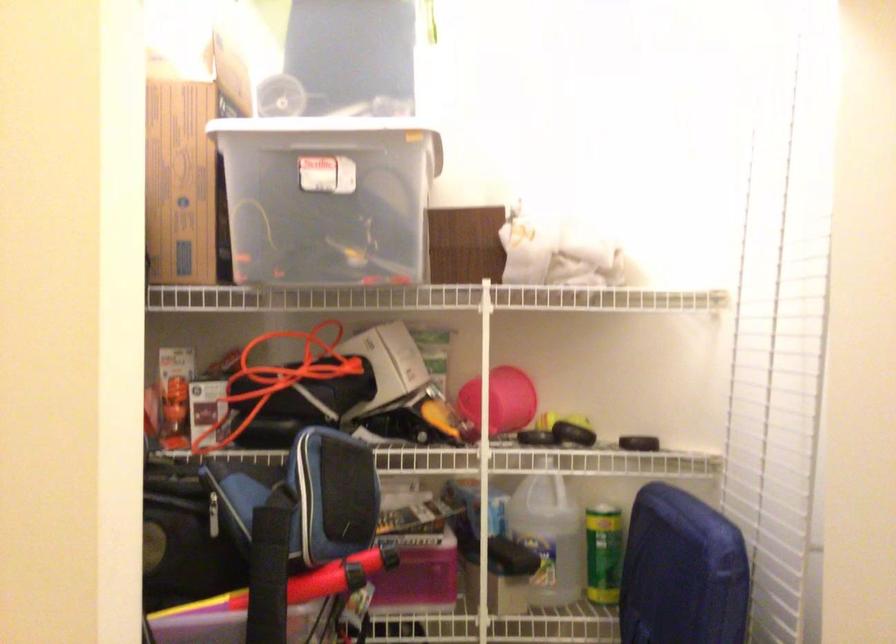
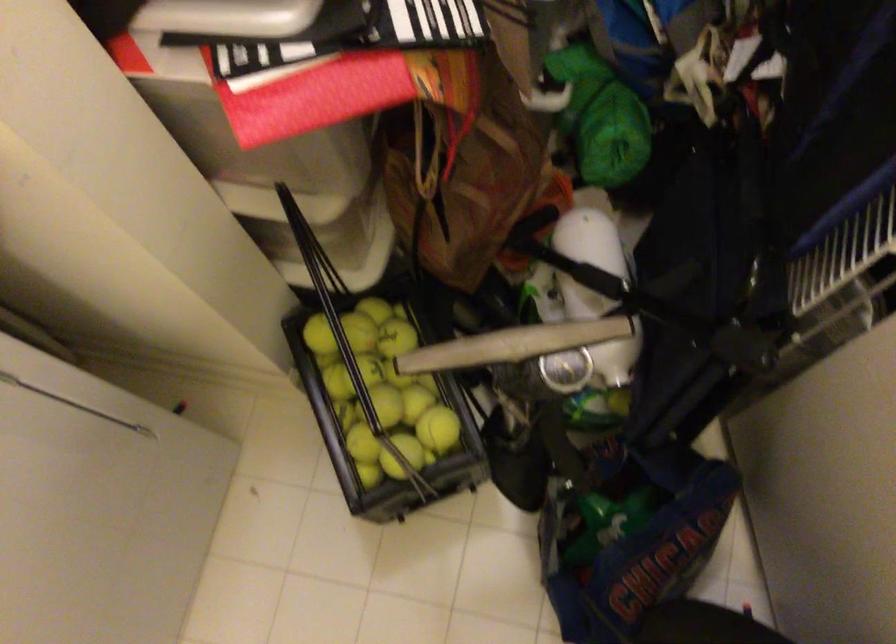
First-person continuous shooting, in which direction is the camera rotating?

The camera's rotation is toward left-down.